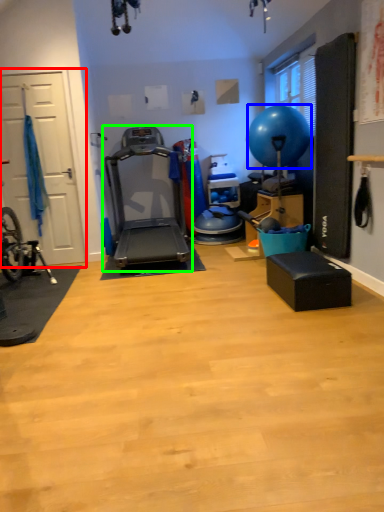
Question: Which object is the closest to the garage door (highlighted by a red box)? Choose among these: balloon (highlighted by a blue box) or treadmill (highlighted by a green box).

Choices:
 (A) balloon
 (B) treadmill

Answer: (B)